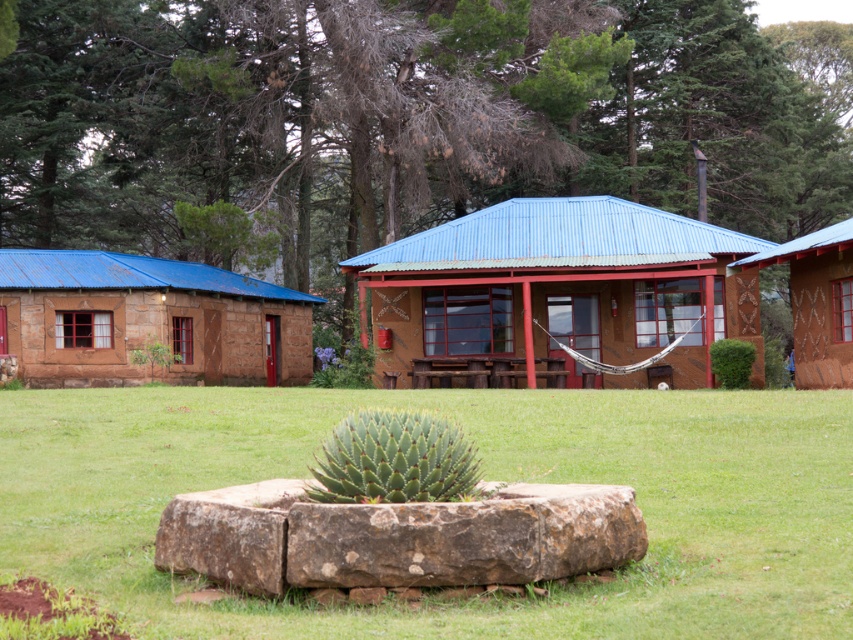
You are standing in the middle of the lawn in front of the brown clay cabin at center and want to walk to the brown textured cabin at right. Which direction should you face to head towards it?

The brown textured cabin at right is located above the brown clay cabin at center, so you should face upwards to head towards it.

Based on the photo, you are standing in the serene outdoor setting described. You want to place a 2.5 meter long wooden bench on the green grass at center. Can you fit it there without it overlapping any other objects?

The green grass at center is 5.33 meters away from the viewer, but the distance alone doesn not determine if the bench will fit. Since there are no other objects mentioned near the green grass at center, the bench can likely be placed there without overlapping other objects.